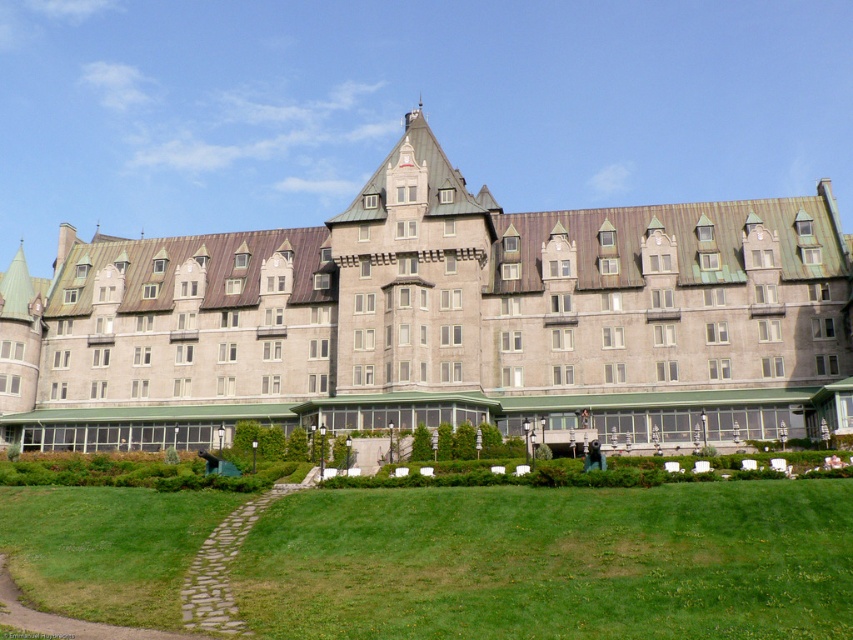
Question: Can you confirm if gray stone building at center is wider than green grass at lower center?

Choices:
 (A) yes
 (B) no

Answer: (A)

Question: Among these points, which one is farthest from the camera?

Choices:
 (A) (585, 516)
 (B) (602, 412)

Answer: (B)

Question: Is gray stone building at center thinner than green grass at lower center?

Choices:
 (A) yes
 (B) no

Answer: (B)

Question: Is gray stone building at center wider than green grass at lower center?

Choices:
 (A) yes
 (B) no

Answer: (A)

Question: Which point is closer to the camera?

Choices:
 (A) gray stone building at center
 (B) green grass at lower center

Answer: (B)